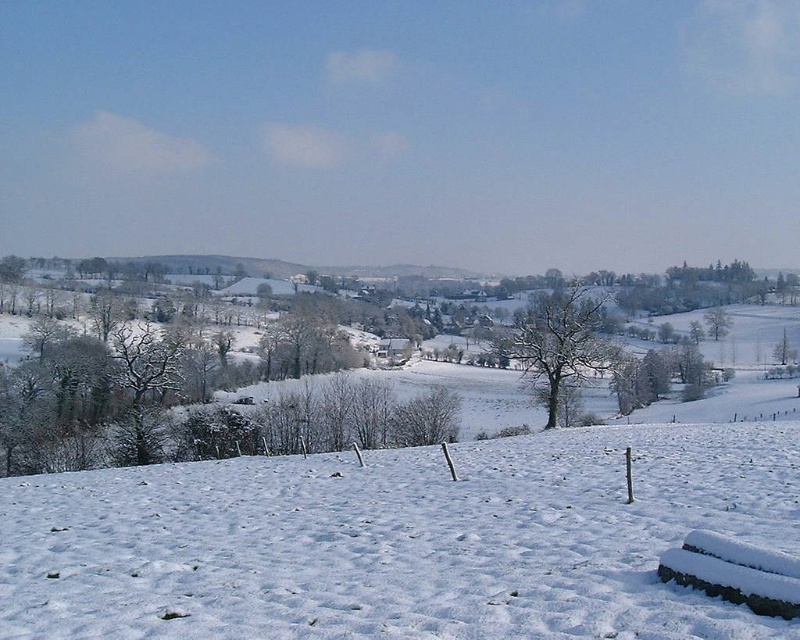
Question: Which point is farther to the camera?

Choices:
 (A) bare snow-covered tree at center
 (B) white snow at lower center

Answer: (A)

Question: Which of the following is the closest to the observer?

Choices:
 (A) white snow at lower center
 (B) bare snow-covered tree at center

Answer: (A)

Question: Can you confirm if white snow at lower center is positioned above bare snow-covered tree at center?

Choices:
 (A) yes
 (B) no

Answer: (B)

Question: Is white snow at lower center thinner than bare snow-covered tree at center?

Choices:
 (A) no
 (B) yes

Answer: (A)

Question: Is white snow at lower center to the left of bare snow-covered tree at center from the viewer's perspective?

Choices:
 (A) no
 (B) yes

Answer: (B)